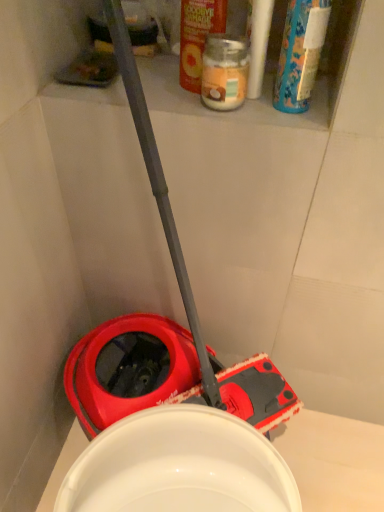
Question: Can you confirm if orange matte jar at upper center, which is the 1th cleaning product from left to right, is thinner than translucent glass jar at upper center?

Choices:
 (A) yes
 (B) no

Answer: (A)

Question: Is orange matte jar at upper center, the 2th cleaning product viewed from the right, outside of translucent glass jar at upper center?

Choices:
 (A) no
 (B) yes

Answer: (B)

Question: Is orange matte jar at upper center, which is the 1th cleaning product from left to right, smaller than translucent glass jar at upper center?

Choices:
 (A) no
 (B) yes

Answer: (A)

Question: Does orange matte jar at upper center, the 2th cleaning product viewed from the right, have a lesser height compared to translucent glass jar at upper center?

Choices:
 (A) no
 (B) yes

Answer: (A)

Question: Does orange matte jar at upper center, the 2th cleaning product viewed from the right, appear on the left side of translucent glass jar at upper center?

Choices:
 (A) yes
 (B) no

Answer: (A)

Question: Is orange matte jar at upper center, the 2th cleaning product viewed from the right, further to the viewer compared to translucent glass jar at upper center?

Choices:
 (A) no
 (B) yes

Answer: (A)

Question: Is translucent glass jar at upper center thinner than orange matte jar at upper center, which is the 1th cleaning product from left to right?

Choices:
 (A) no
 (B) yes

Answer: (A)

Question: Is translucent glass jar at upper center looking in the opposite direction of orange matte jar at upper center, which is the 1th cleaning product from left to right?

Choices:
 (A) no
 (B) yes

Answer: (B)

Question: Considering the relative sizes of translucent glass jar at upper center and orange matte jar at upper center, which is the 1th cleaning product from left to right, in the image provided, is translucent glass jar at upper center wider than orange matte jar at upper center, which is the 1th cleaning product from left to right,?

Choices:
 (A) yes
 (B) no

Answer: (A)

Question: From the image's perspective, is translucent glass jar at upper center under orange matte jar at upper center, which is the 1th cleaning product from left to right?

Choices:
 (A) no
 (B) yes

Answer: (B)

Question: From the image's perspective, is translucent glass jar at upper center located above orange matte jar at upper center, the 2th cleaning product viewed from the right?

Choices:
 (A) no
 (B) yes

Answer: (A)

Question: Does translucent glass jar at upper center contain orange matte jar at upper center, the 2th cleaning product viewed from the right?

Choices:
 (A) yes
 (B) no

Answer: (B)

Question: Does blue plastic bottle at upper right, positioned as the second cleaning product in left-to-right order, appear on the right side of translucent glass jar at upper center?

Choices:
 (A) no
 (B) yes

Answer: (B)